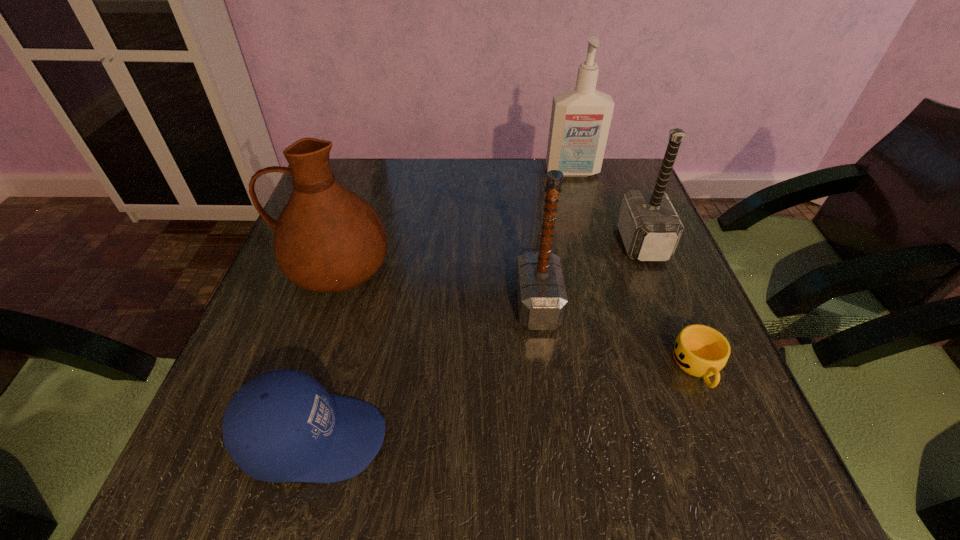
The height and width of the screenshot is (540, 960). What are the coordinates of `pitcher situated at the left edge` in the screenshot? It's located at (327, 239).

Locate an element on the screen. The image size is (960, 540). cap that is at the left edge is located at coordinates (282, 426).

This screenshot has height=540, width=960. I want to click on cleansing agent that is at the right edge, so click(x=580, y=121).

This screenshot has width=960, height=540. I want to click on hammer situated at the right edge, so click(650, 228).

The image size is (960, 540). Identify the location of cup at the right edge. [x=699, y=350].

In order to click on object situated at the near left corner in this screenshot , I will do `click(282, 426)`.

Locate an element on the screen. The width and height of the screenshot is (960, 540). object located at the far right corner is located at coordinates (580, 121).

The height and width of the screenshot is (540, 960). In order to click on free space at the far edge in this screenshot , I will do `click(417, 170)`.

Locate an element on the screen. Image resolution: width=960 pixels, height=540 pixels. vacant point at the left edge is located at coordinates (297, 289).

This screenshot has width=960, height=540. In the image, there is a desktop. Identify the location of vacant space at the right edge. (637, 298).